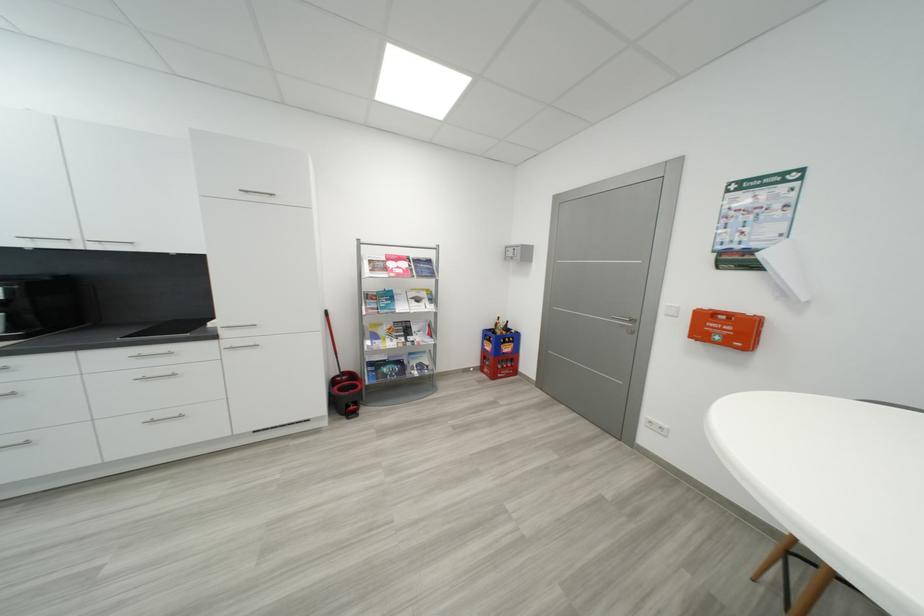
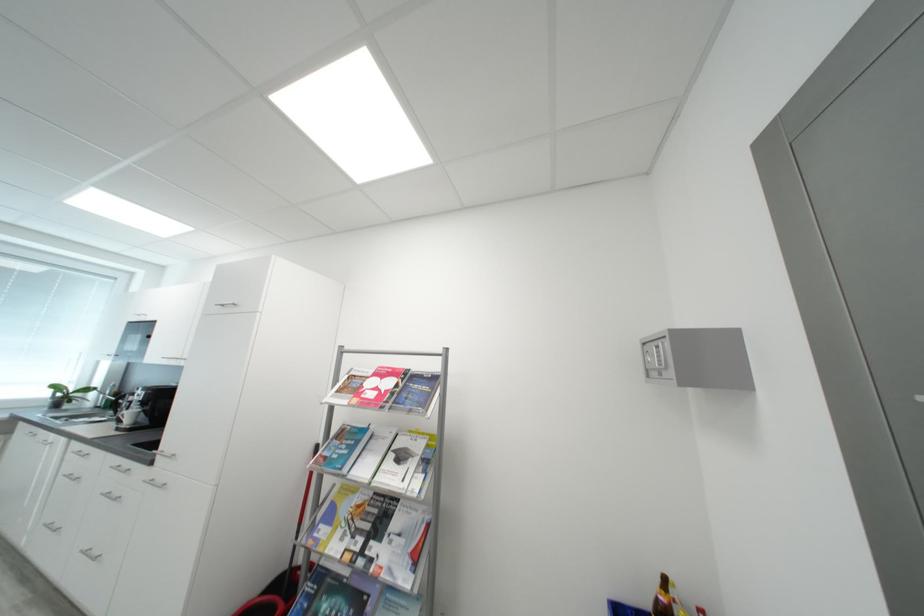
The point at (418,339) is marked in the first image. Where is the corresponding point in the second image?

(380, 549)